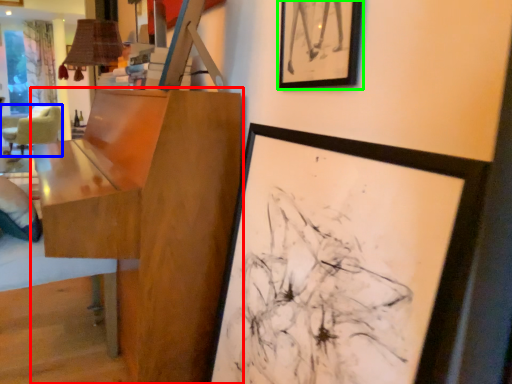
Question: Considering the real-world distances, which object is closest to table (highlighted by a red box)? chair (highlighted by a blue box) or picture frame (highlighted by a green box).

Choices:
 (A) chair
 (B) picture frame

Answer: (B)